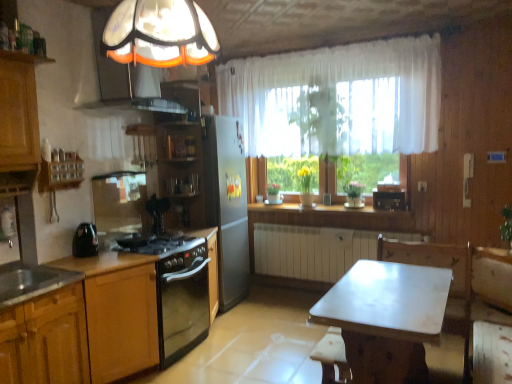
The width and height of the screenshot is (512, 384). I want to click on blank space situated above white marble table at center (from a real-world perspective), so click(x=408, y=291).